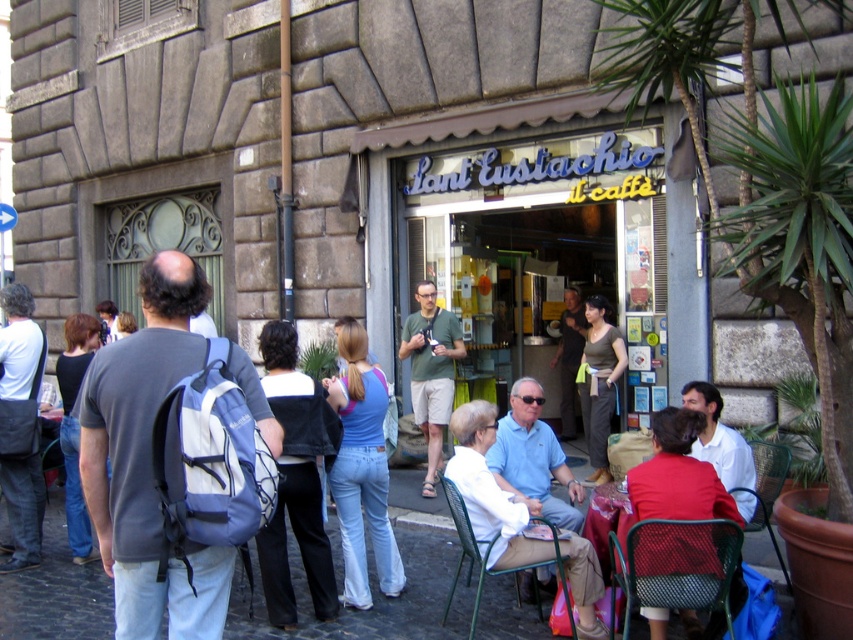
Can you confirm if smooth stone pavement at center is wider than denim jeans at center?

Correct, the width of smooth stone pavement at center exceeds that of denim jeans at center.

Describe the element at coordinates (376, 582) in the screenshot. I see `smooth stone pavement at center` at that location.

Where is `smooth stone pavement at center`? The image size is (853, 640). smooth stone pavement at center is located at coordinates (376, 582).

Is dark brown leather jacket at center wider than red fabric jacket at lower right?

No, dark brown leather jacket at center is not wider than red fabric jacket at lower right.

The width and height of the screenshot is (853, 640). What do you see at coordinates (569, 356) in the screenshot? I see `dark brown leather jacket at center` at bounding box center [569, 356].

The width and height of the screenshot is (853, 640). Find the location of `dark brown leather jacket at center`. dark brown leather jacket at center is located at coordinates pos(569,356).

Consider the image. Does white fabric bag at left have a lesser height compared to metallic mesh chair at lower right?

No.

Identify the location of white fabric bag at left. (19, 344).

This screenshot has width=853, height=640. What are the coordinates of `white fabric bag at left` in the screenshot? It's located at (19, 344).